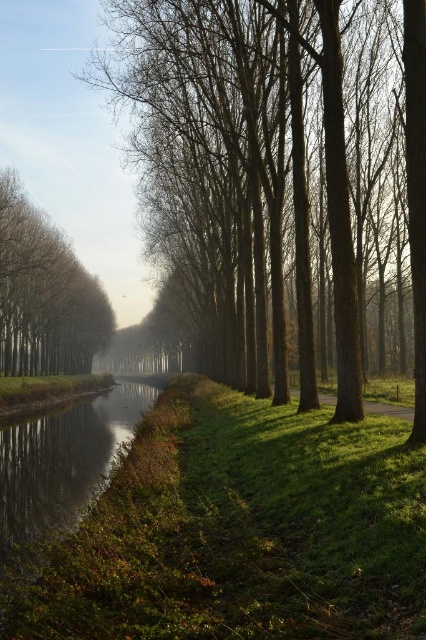
Which is above, smooth bark trees at center or green grassy path at center?

smooth bark trees at center

Is smooth bark trees at center in front of green grassy path at center?

Yes, it is in front of green grassy path at center.

Does point (201, 80) come closer to viewer compared to point (367, 408)?

No, (201, 80) is behind (367, 408).

The height and width of the screenshot is (640, 426). I want to click on smooth bark trees at center, so click(270, 176).

Does brown smooth tree at left come behind green grassy path at center?

Yes, it is.

Does brown smooth tree at left appear under green grassy path at center?

No.

What do you see at coordinates (45, 294) in the screenshot? The width and height of the screenshot is (426, 640). I see `brown smooth tree at left` at bounding box center [45, 294].

This screenshot has width=426, height=640. Find the location of `brown smooth tree at left`. brown smooth tree at left is located at coordinates [x=45, y=294].

Does smooth bark trees at center appear under brown smooth tree at left?

No.

Based on the photo, who is more forward, (212, 168) or (109, 308)?

Positioned in front is point (212, 168).

Find the location of a particular element. This screenshot has height=640, width=426. smooth bark trees at center is located at coordinates (270, 176).